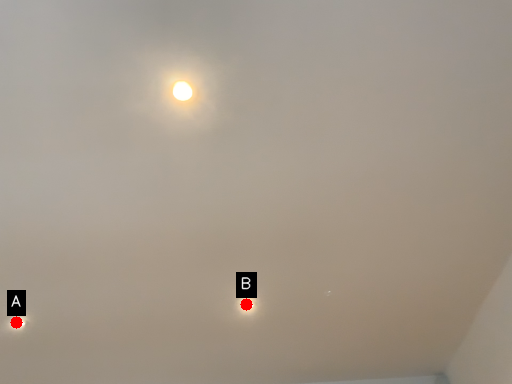
Question: Two points are circled on the image, labeled by A and B beside each circle. Which point is farther to the camera?

Choices:
 (A) A is further
 (B) B is further

Answer: (A)